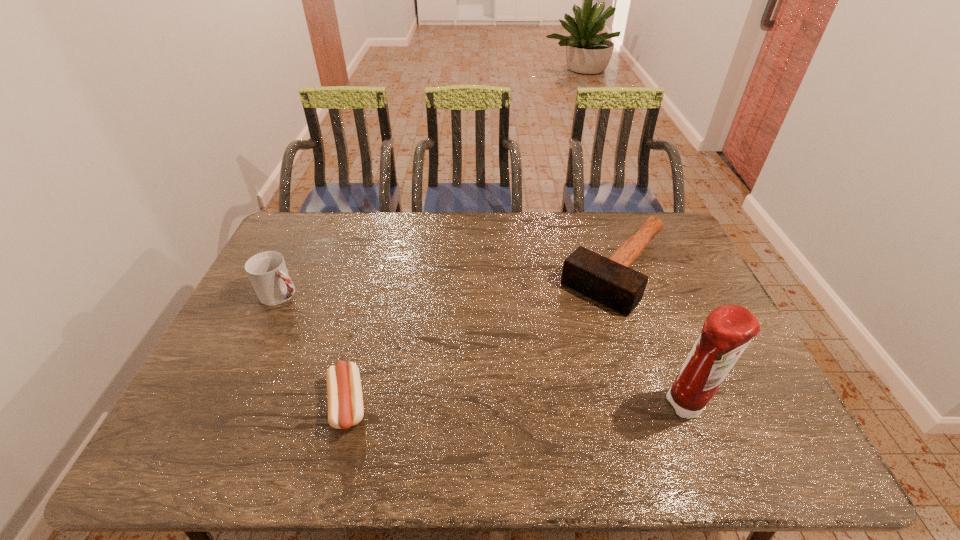
This screenshot has height=540, width=960. Identify the location of object positioned at the far right corner. (609, 281).

Identify the location of object present at the near right corner. Image resolution: width=960 pixels, height=540 pixels. (727, 331).

Find the location of `vacant space at the far edge of the desktop`. vacant space at the far edge of the desktop is located at coordinates pyautogui.click(x=336, y=219).

I want to click on blank space at the near edge of the desktop, so click(x=612, y=400).

In the image, there is a desktop. Where is `vacant space at the left edge`? The image size is (960, 540). vacant space at the left edge is located at coordinates (225, 370).

Locate an element on the screen. This screenshot has width=960, height=540. vacant space at the right edge of the desktop is located at coordinates (650, 254).

At what (x,y) coordinates should I click in order to perform the action: click on free region at the far left corner of the desktop. Please return your answer as a coordinate pair (x, y). This screenshot has height=540, width=960. Looking at the image, I should click on (332, 218).

Locate an element on the screen. This screenshot has width=960, height=540. vacant region at the near left corner of the desktop is located at coordinates (244, 393).

The width and height of the screenshot is (960, 540). Identify the location of vacant space that is in between the mallet and the condiment. (652, 338).

Locate an element on the screen. Image resolution: width=960 pixels, height=540 pixels. vacant area between the third tallest object and the second object from left to right is located at coordinates (482, 338).